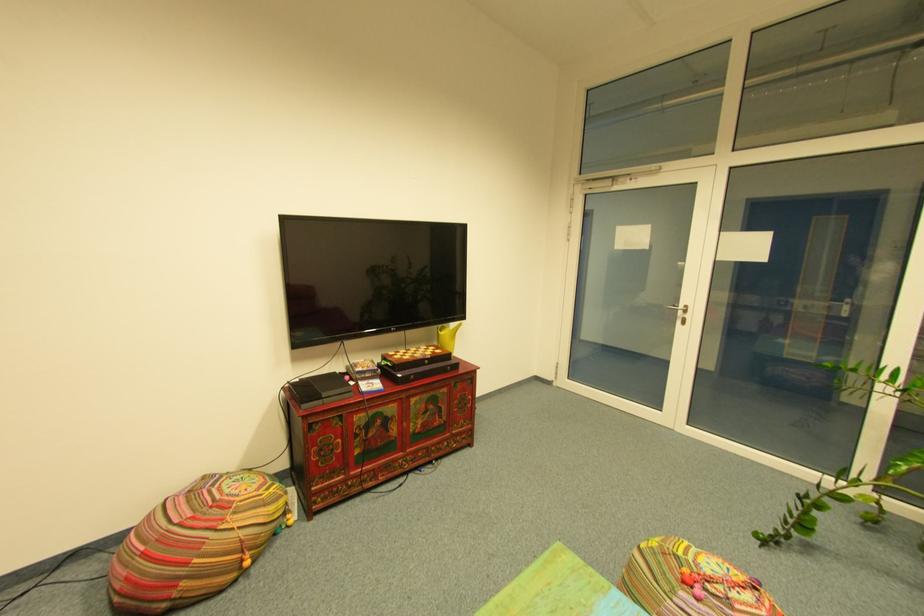
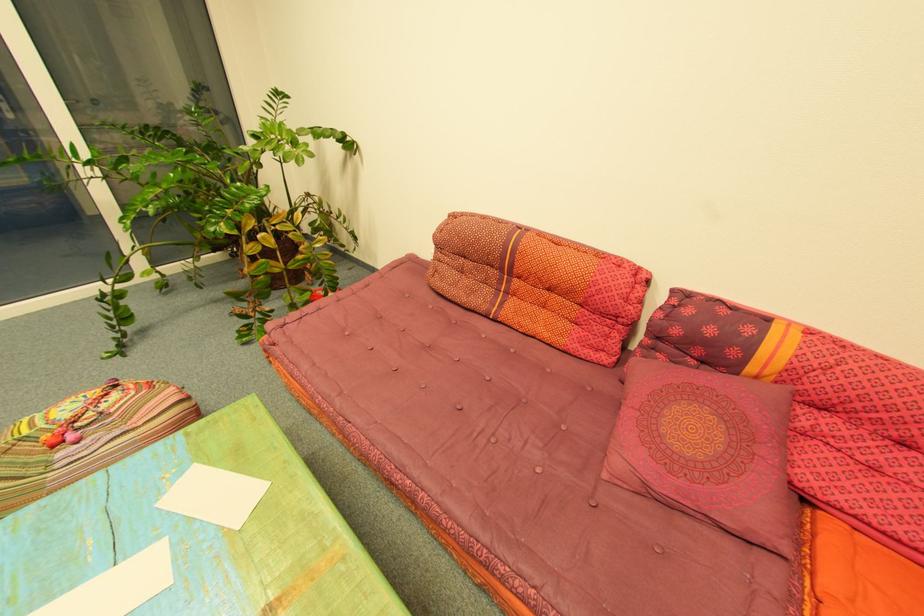
How did the camera likely rotate?

The rotation direction of the camera is right-down.